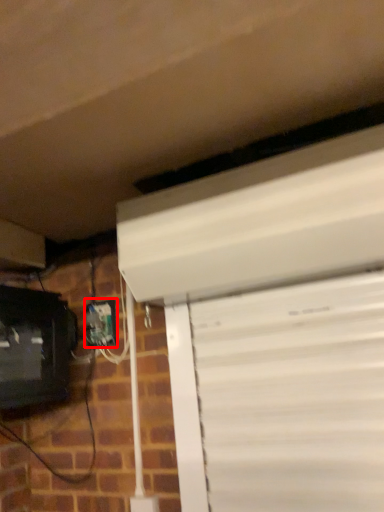
Question: From the image's perspective, where is electric outlet (annotated by the red box) located in relation to computer monitor in the image?

Choices:
 (A) above
 (B) below

Answer: (A)